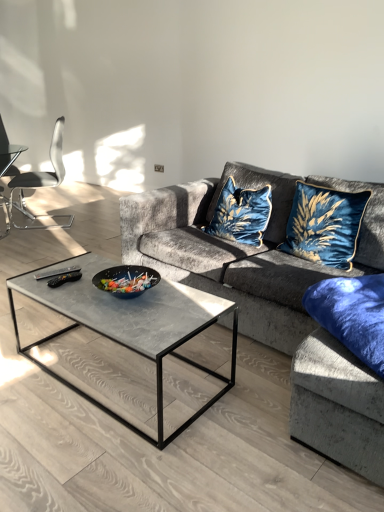
Question: From the image's perspective, is velvet blue cat-shaped pillow at center, which appears as the 2th throw pillow when viewed from the right, above velvet blue cushion at upper right, which is the first throw pillow from right to left?

Choices:
 (A) yes
 (B) no

Answer: (A)

Question: From a real-world perspective, is velvet blue cat-shaped pillow at center, which appears as the 2th throw pillow when viewed from the right, under velvet blue cushion at upper right, the 2th throw pillow when ordered from left to right?

Choices:
 (A) yes
 (B) no

Answer: (A)

Question: Can you confirm if velvet blue cat-shaped pillow at center, arranged as the 1th throw pillow when viewed from the left, is positioned to the left of velvet blue cushion at upper right, the 2th throw pillow when ordered from left to right?

Choices:
 (A) yes
 (B) no

Answer: (A)

Question: Can you confirm if velvet blue cat-shaped pillow at center, which appears as the 2th throw pillow when viewed from the right, is bigger than velvet blue cushion at upper right, the 2th throw pillow when ordered from left to right?

Choices:
 (A) no
 (B) yes

Answer: (B)

Question: Is velvet blue cat-shaped pillow at center, which appears as the 2th throw pillow when viewed from the right, taller than velvet blue cushion at upper right, the 2th throw pillow when ordered from left to right?

Choices:
 (A) yes
 (B) no

Answer: (B)

Question: In the image, is metallic silver chair at left positioned in front of or behind velvet fabric couch at center?

Choices:
 (A) front
 (B) behind

Answer: (B)

Question: Considering the positions of metallic silver chair at left and velvet fabric couch at center in the image, is metallic silver chair at left taller or shorter than velvet fabric couch at center?

Choices:
 (A) tall
 (B) short

Answer: (A)

Question: From a real-world perspective, is metallic silver chair at left positioned above or below velvet fabric couch at center?

Choices:
 (A) below
 (B) above

Answer: (B)

Question: Is point (61, 225) positioned closer to the camera than point (279, 293)?

Choices:
 (A) closer
 (B) farther

Answer: (B)

Question: From the image's perspective, is velvet blue cat-shaped pillow at center, arranged as the 1th throw pillow when viewed from the left, positioned above or below velvet fabric couch at center?

Choices:
 (A) below
 (B) above

Answer: (B)

Question: From a real-world perspective, relative to velvet fabric couch at center, is velvet blue cat-shaped pillow at center, arranged as the 1th throw pillow when viewed from the left, vertically above or below?

Choices:
 (A) below
 (B) above

Answer: (B)

Question: In terms of width, does velvet blue cat-shaped pillow at center, which appears as the 2th throw pillow when viewed from the right, look wider or thinner when compared to velvet fabric couch at center?

Choices:
 (A) wide
 (B) thin

Answer: (B)

Question: Based on their positions, is velvet blue cat-shaped pillow at center, which appears as the 2th throw pillow when viewed from the right, located to the left or right of velvet fabric couch at center?

Choices:
 (A) left
 (B) right

Answer: (A)

Question: Considering the positions of point (182, 209) and point (59, 138), is point (182, 209) closer or farther from the camera than point (59, 138)?

Choices:
 (A) farther
 (B) closer

Answer: (B)

Question: From the image's perspective, is velvet fabric couch at center located above or below metallic silver chair at left?

Choices:
 (A) above
 (B) below

Answer: (B)